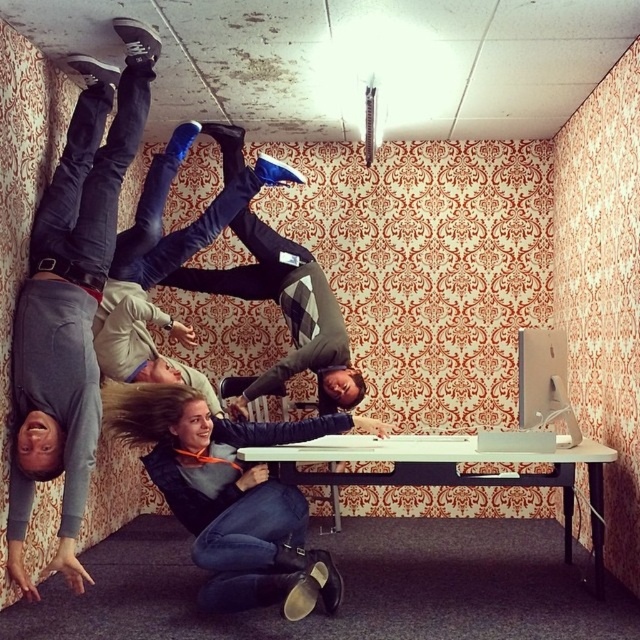
Looking at this image, you are standing in the room and want to reach the gray matte pants at lower left. Considering your height is 1.7 meters, can you touch them without any assistance?

The gray matte pants at lower left are 3.03 meters away from the viewer. Since the distance is greater than your height of 1.7 meters, you cannot touch them without assistance.

In the scene shown: You are a photographer trying to capture the scene where the gray matte pants at lower left and white glossy table at center are visible. Which object should you focus on first if you want to ensure both are in frame without moving the camera?

The gray matte pants at lower left is smaller than the white glossy table at center, so focusing on the larger white glossy table at center first would help ensure both objects are within the camera frame.

You are standing in the room and looking at the image. There is a point marked at coordinates (72, 300). What object is located at that point?

The object located at point (72, 300) is the gray matte pants at lower left.